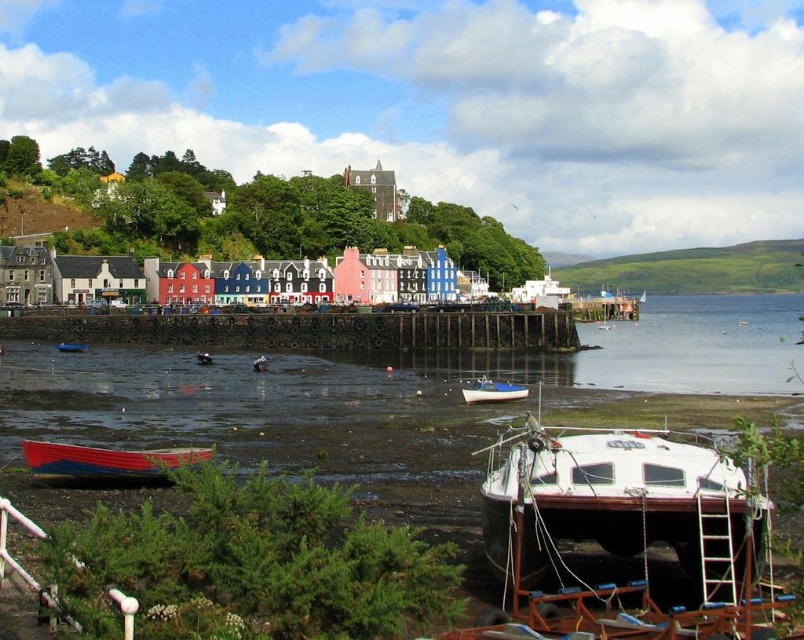
In the scene shown: You are a tourist visiting the coastal town and want to take a photo of both the white matte boat at lower right and the wooden rowboat at lower left. Which boat should you position closer to in your photo to ensure both are fully visible in the frame?

You should position closer to the wooden rowboat at lower left because the white matte boat at lower right is larger and might dominate the frame if you are too close to it, making the wooden rowboat at lower left appear too small.

You are a tourist standing on the black concrete dock at center and want to take a photo of the red wood boat at lower left. Can you see the boat clearly from your current position?

The red wood boat at lower left is behind the black concrete dock at center, so you cannot see it clearly from your current position on the dock.